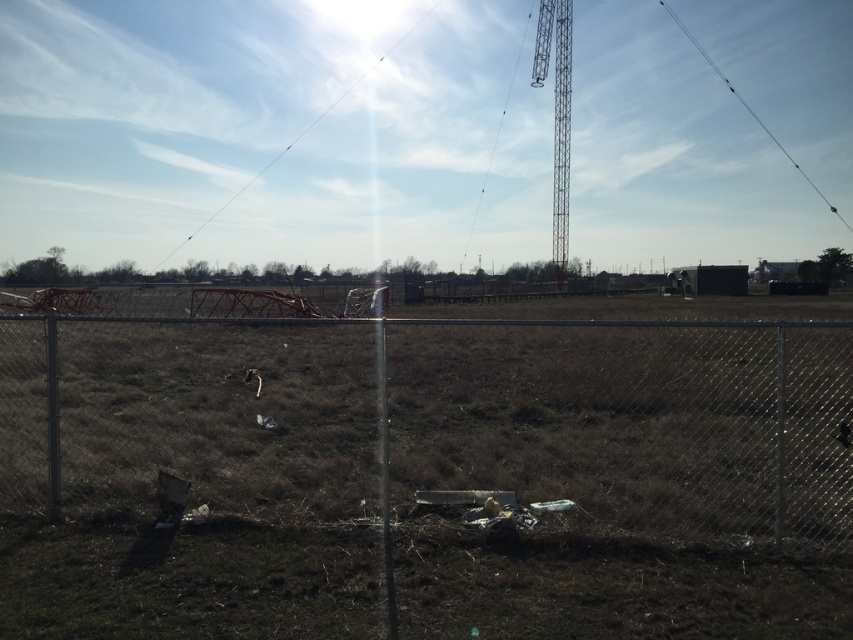
Who is more distant from viewer, (428, 8) or (722, 77)?

Positioned behind is point (722, 77).

Is transparent wire at upper center smaller than black wire at upper right?

No, transparent wire at upper center is not smaller than black wire at upper right.

Between point (202, 227) and point (782, 148), which one is positioned in front?

Point (202, 227) is more forward.

Find the location of a particular element. This screenshot has width=853, height=640. transparent wire at upper center is located at coordinates click(x=296, y=136).

Does metal chain-link fence at center have a larger size compared to black wire at upper right?

Actually, metal chain-link fence at center might be smaller than black wire at upper right.

Does point (490, 468) lie in front of point (666, 10)?

Yes, point (490, 468) is closer to viewer.

Does point (659, 401) come closer to viewer compared to point (769, 134)?

Yes, point (659, 401) is closer to viewer.

Find the location of a particular element. Image resolution: width=853 pixels, height=640 pixels. metal chain-link fence at center is located at coordinates (440, 419).

You are a GUI agent. You are given a task and a screenshot of the screen. Output one action in this format:
    pyautogui.click(x=<x>, y=<y>)
    Task: Click on the metal chain-link fence at center
    This screenshot has width=853, height=640.
    Given the screenshot: What is the action you would take?
    pyautogui.click(x=440, y=419)

Who is more forward, (x=471, y=416) or (x=556, y=275)?

Positioned in front is point (x=471, y=416).

The height and width of the screenshot is (640, 853). In order to click on metal chain-link fence at center in this screenshot , I will do `click(440, 419)`.